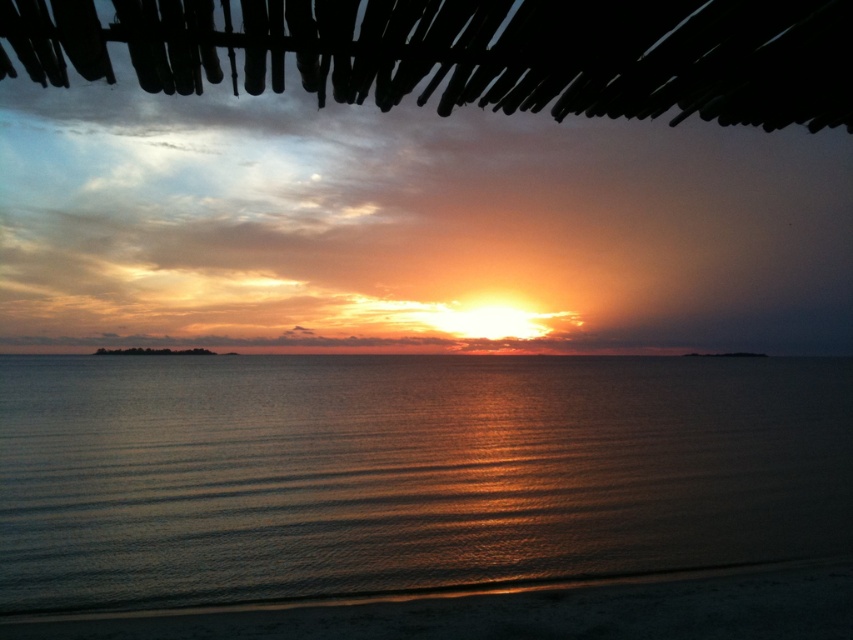
You are a photographer trying to capture the reflection of the sun in the shiny metallic water at center. Based on the coordinates provided, where should you position your camera to ensure the reflection is centered in your shot?

The shiny metallic water at center is located at coordinates point [405,472], so you should position your camera directly above or aligned with these coordinates to center the reflection in your shot.

You are standing on the shore of the ocean in the sunset scene. You see a point marked at coordinates (405, 472). What is located at that point?

The point at coordinates (405, 472) is where the shiny metallic water at center is located.